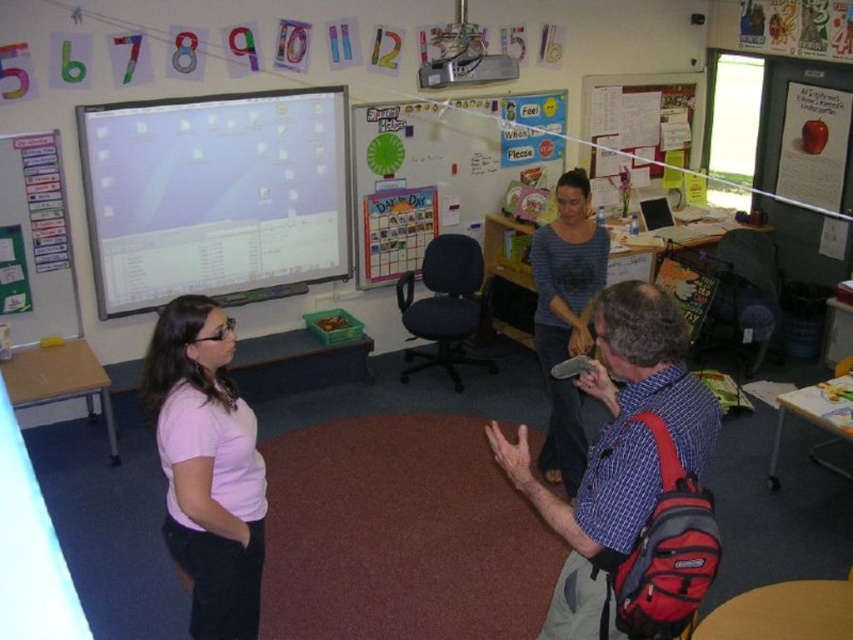
Question: Which object appears closest to the camera in this image?

Choices:
 (A) plaid shirt at center
 (B) pink fabric shirt at left

Answer: (A)

Question: Among these points, which one is farthest from the camera?

Choices:
 (A) (590, 292)
 (B) (134, 145)

Answer: (B)

Question: Can you confirm if pink fabric shirt at left is positioned below blue striped sweater at center?

Choices:
 (A) yes
 (B) no

Answer: (A)

Question: Is matte white screen at upper left further to the viewer compared to pink fabric shirt at left?

Choices:
 (A) yes
 (B) no

Answer: (A)

Question: Is matte white screen at upper left thinner than blue striped sweater at center?

Choices:
 (A) no
 (B) yes

Answer: (A)

Question: Which object is positioned farthest from the plaid shirt at center?

Choices:
 (A) whiteboard at upper center
 (B) blue striped sweater at center

Answer: (A)